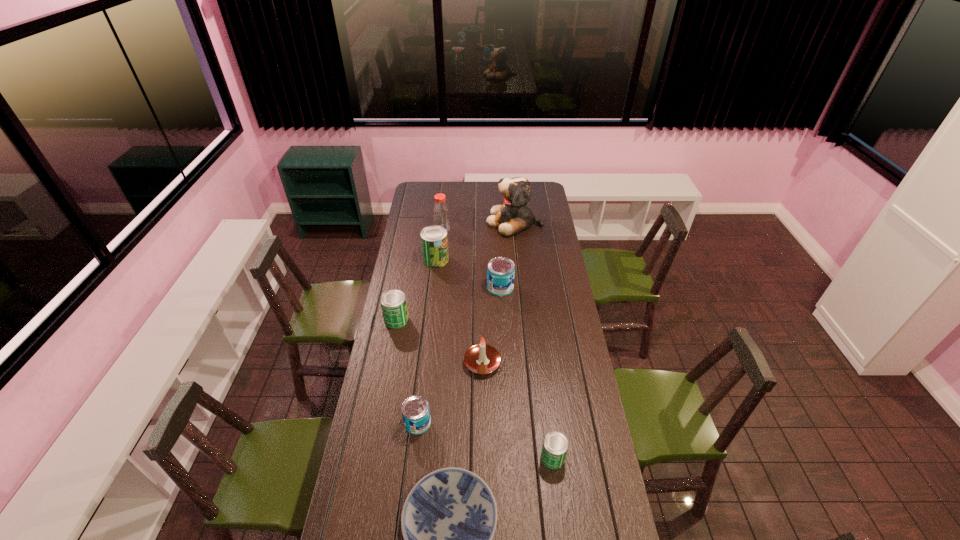
I want to click on unoccupied position between the eighth shortest object and the seventh farthest object, so click(430, 326).

Locate an element on the screen. This screenshot has height=540, width=960. free space that is in between the nearer blue can and the leftmost green can is located at coordinates (407, 371).

At what (x,y) coordinates should I click in order to perform the action: click on free space between the third nearest can and the eighth shortest object. Please return your answer as a coordinate pair (x, y). Looking at the image, I should click on (420, 274).

Where is `vacant space that's between the nearer blue can and the candle`? The image size is (960, 540). vacant space that's between the nearer blue can and the candle is located at coordinates (450, 393).

The width and height of the screenshot is (960, 540). In order to click on empty space that is in between the tallest object and the left blue can in this screenshot , I will do `click(467, 322)`.

Find the location of a particular element. This screenshot has width=960, height=540. vacant area between the bigger blue can and the puppy is located at coordinates (508, 254).

Find the location of a particular element. The width and height of the screenshot is (960, 540). object that stands as the third closest to the nearer blue can is located at coordinates (555, 445).

Identify the location of object that ranks as the seventh closest to the fourth can from left to right. (555, 445).

Identify which can is the fourth nearest to the smallest green can. Please provide its 2D coordinates. Your answer should be formatted as a tuple, i.e. [(x, y)], where the tuple contains the x and y coordinates of a point satisfying the conditions above.

[(434, 242)]

Select which can is the closest to the smaller blue can. Please provide its 2D coordinates. Your answer should be formatted as a tuple, i.e. [(x, y)], where the tuple contains the x and y coordinates of a point satisfying the conditions above.

[(555, 445)]